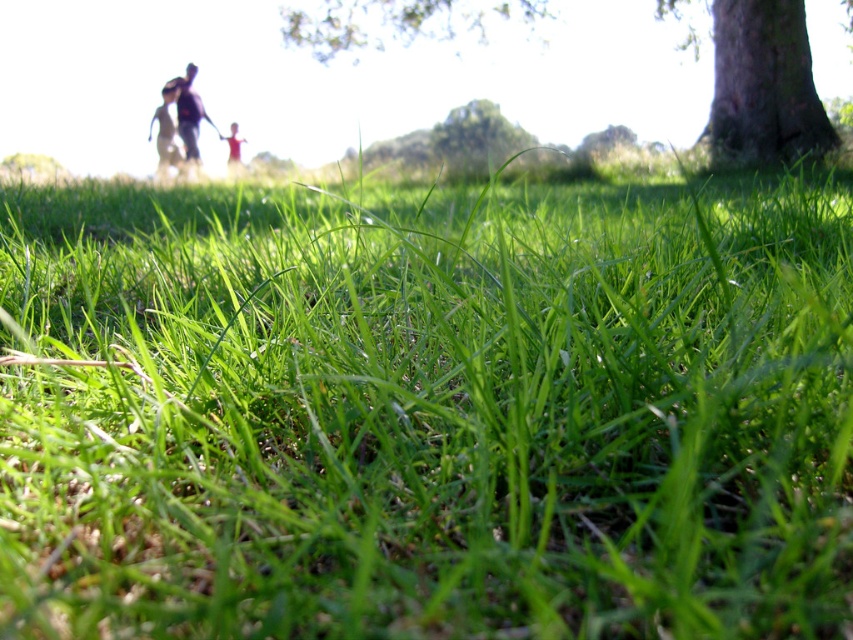
Question: Is dark blue shirt at upper center to the left of blurred pink dress at center from the viewer's perspective?

Choices:
 (A) yes
 (B) no

Answer: (A)

Question: Which object is closer to the camera taking this photo?

Choices:
 (A) blurred pink dress at center
 (B) smooth bark tree at upper right
 (C) dark gray figure at upper left

Answer: (B)

Question: Does smooth bark tree at upper right appear over dark gray figure at upper left?

Choices:
 (A) yes
 (B) no

Answer: (A)

Question: Which of the following is the farthest from the observer?

Choices:
 (A) dark blue shirt at upper center
 (B) dark gray figure at upper left
 (C) blurred pink dress at center
 (D) smooth bark tree at upper right

Answer: (C)

Question: Does green rough bark tree at right lie behind blurred pink dress at center?

Choices:
 (A) no
 (B) yes

Answer: (A)

Question: Which object is the farthest from the dark gray figure at upper left?

Choices:
 (A) dark blue shirt at upper center
 (B) green rough bark tree at right
 (C) smooth bark tree at upper right
 (D) blurred pink dress at center

Answer: (B)